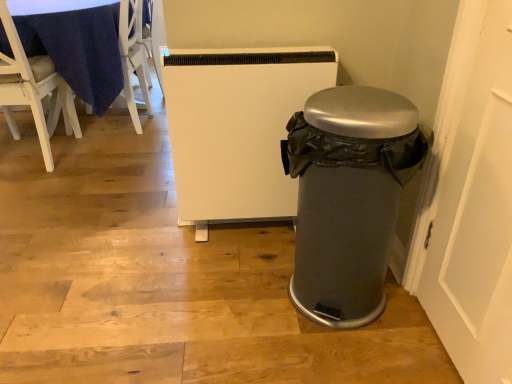
Question: Does white wood chair at left, marked as the 2th chair in a right-to-left arrangement, have a larger size compared to white wood chair at upper left, arranged as the 2th chair when viewed from the left?

Choices:
 (A) yes
 (B) no

Answer: (A)

Question: Is the depth of white wood chair at left, marked as the 2th chair in a right-to-left arrangement, less than that of white wood chair at upper left, arranged as the 2th chair when viewed from the left?

Choices:
 (A) no
 (B) yes

Answer: (B)

Question: From a real-world perspective, is white wood chair at left, placed as the first chair when sorted from left to right, positioned under white wood chair at upper left, the 1th chair viewed from the right, based on gravity?

Choices:
 (A) yes
 (B) no

Answer: (B)

Question: Does white wood chair at left, marked as the 2th chair in a right-to-left arrangement, appear on the right side of white wood chair at upper left, the 1th chair viewed from the right?

Choices:
 (A) no
 (B) yes

Answer: (A)

Question: From the image's perspective, is white wood chair at left, placed as the first chair when sorted from left to right, located above white wood chair at upper left, the 1th chair viewed from the right?

Choices:
 (A) no
 (B) yes

Answer: (A)

Question: Is there a large distance between white wood chair at left, marked as the 2th chair in a right-to-left arrangement, and white wood chair at upper left, arranged as the 2th chair when viewed from the left?

Choices:
 (A) yes
 (B) no

Answer: (B)

Question: Does white wood chair at upper left, the 1th chair viewed from the right, have a lesser height compared to white wood chair at left, placed as the first chair when sorted from left to right?

Choices:
 (A) no
 (B) yes

Answer: (B)

Question: From a real-world perspective, is white wood chair at upper left, arranged as the 2th chair when viewed from the left, positioned under white wood chair at left, placed as the first chair when sorted from left to right, based on gravity?

Choices:
 (A) yes
 (B) no

Answer: (A)

Question: From the image's perspective, is white wood chair at upper left, arranged as the 2th chair when viewed from the left, located above white wood chair at left, marked as the 2th chair in a right-to-left arrangement?

Choices:
 (A) no
 (B) yes

Answer: (B)

Question: Can you confirm if white wood chair at upper left, the 1th chair viewed from the right, is positioned to the right of white wood chair at left, marked as the 2th chair in a right-to-left arrangement?

Choices:
 (A) no
 (B) yes

Answer: (B)

Question: Is white wood chair at upper left, the 1th chair viewed from the right, looking in the opposite direction of white wood chair at left, placed as the first chair when sorted from left to right?

Choices:
 (A) no
 (B) yes

Answer: (A)

Question: Is white wood chair at upper left, the 1th chair viewed from the right, far from white wood chair at left, marked as the 2th chair in a right-to-left arrangement?

Choices:
 (A) yes
 (B) no

Answer: (B)

Question: Considering their positions, is white wood chair at upper left, the 1th chair viewed from the right, located in front of or behind white wood chair at left, marked as the 2th chair in a right-to-left arrangement?

Choices:
 (A) behind
 (B) front

Answer: (A)